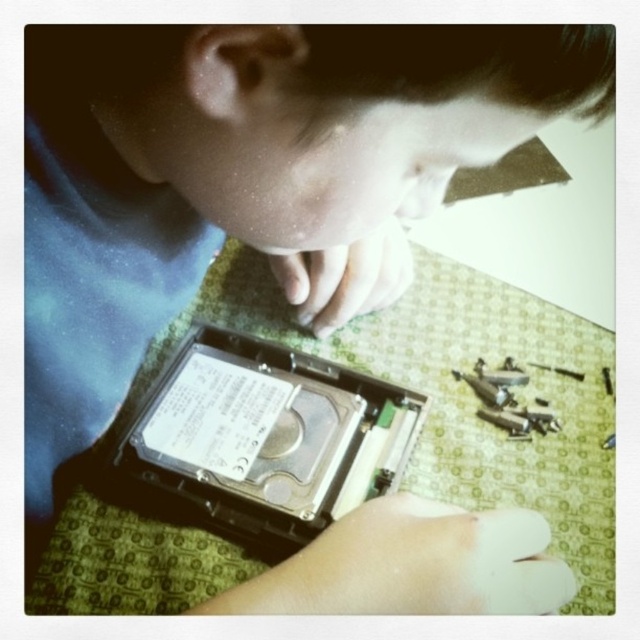
You are observing someone repairing a hard drive. You see a white matte hand at lower center and a matte black hard drive at center. Which object is positioned to the right side?

The white matte hand at lower center is to the right of the matte black hard drive at center.

You are a technician working on a hard drive. You need to access a specific point labeled as point [412,564]. Where is this point located in relation to the white matte hand at lower center?

The point [412,564] is located on the white matte hand at lower center.

You are a technician trying to access the internal components of the matte black hard drive at center. Considering the position of the white matte hand at lower center, can you easily reach the hard drive?

The white matte hand at lower center is in front of the matte black hard drive at center, so it is blocking access to the hard drive. You cannot easily reach the matte black hard drive at center while the white matte hand at lower center is in front of it.